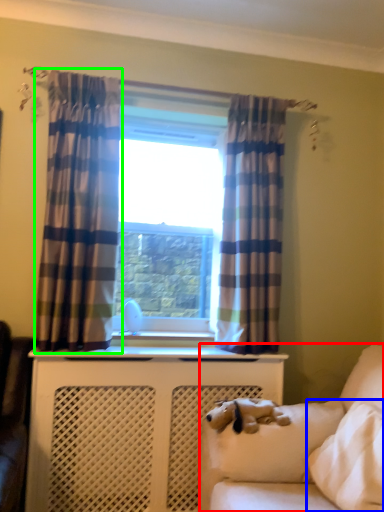
Question: Which object is positioned closest to studio couch (highlighted by a red box)? Select from pillow (highlighted by a blue box) and curtain (highlighted by a green box).

Choices:
 (A) pillow
 (B) curtain

Answer: (A)